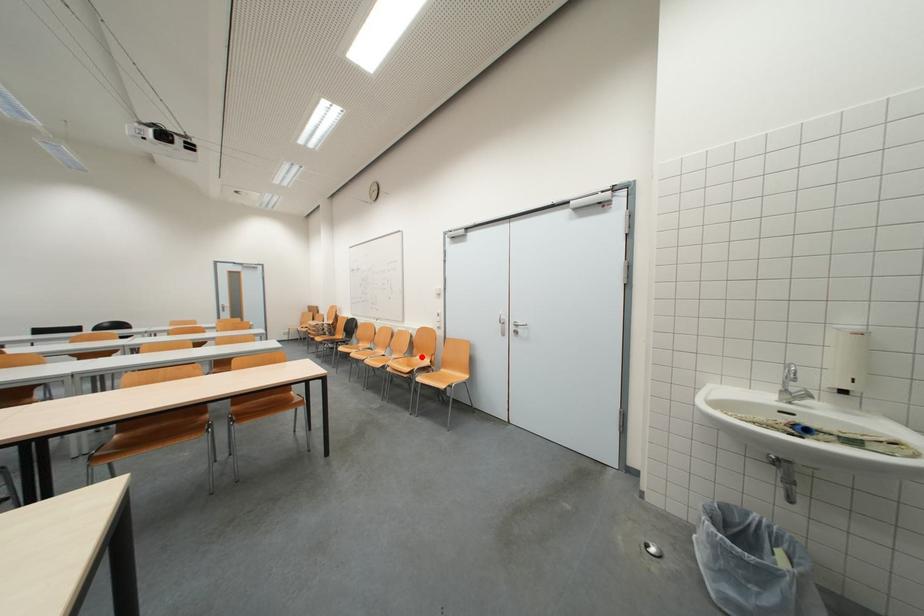
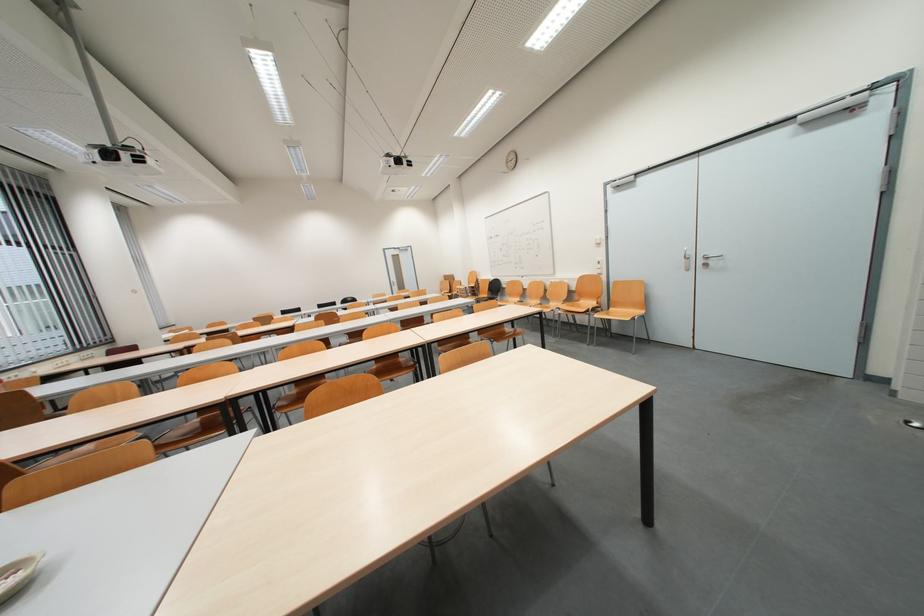
Question: I am providing you with two images of the same scene from different viewpoints. Image1 has a red point marked. In image2, the corresponding 3D location appears at what relative position? Reply with the corresponding letter.

Choices:
 (A) Closer
 (B) Farther

Answer: (A)